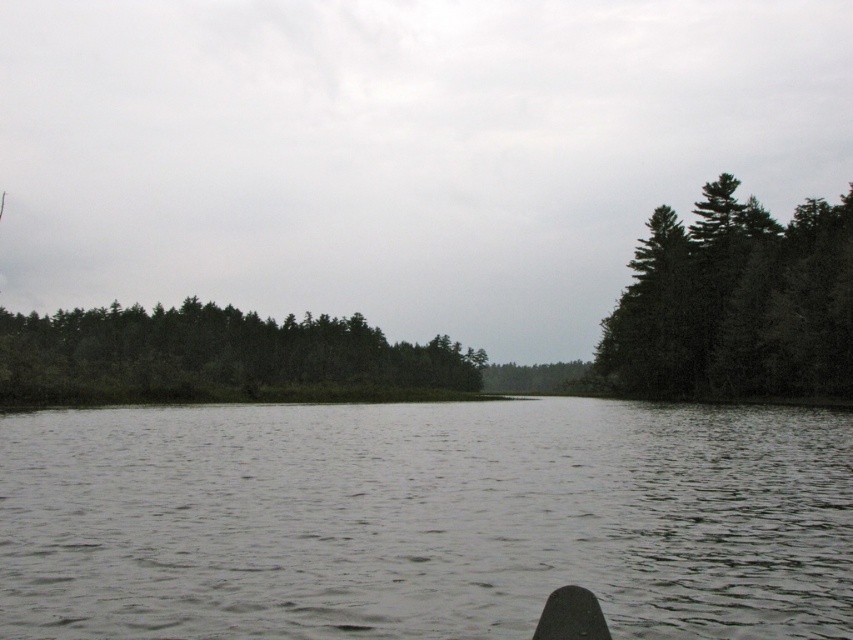
Question: Can you confirm if gray matte water at center is wider than green matte trees at center?

Choices:
 (A) no
 (B) yes

Answer: (A)

Question: Is gray matte water at center further to the viewer compared to dark green textured trees at right?

Choices:
 (A) yes
 (B) no

Answer: (B)

Question: Based on their relative distances, which object is farther from the dark green textured trees at right?

Choices:
 (A) gray matte water at center
 (B) green matte trees at center

Answer: (A)

Question: Does dark green textured trees at right appear over green matte trees at center?

Choices:
 (A) no
 (B) yes

Answer: (B)

Question: Among these objects, which one is farthest from the camera?

Choices:
 (A) gray matte water at center
 (B) dark green textured trees at right

Answer: (B)

Question: Which object is the farthest from the green matte trees at center?

Choices:
 (A) dark green textured trees at right
 (B) gray matte water at center

Answer: (B)